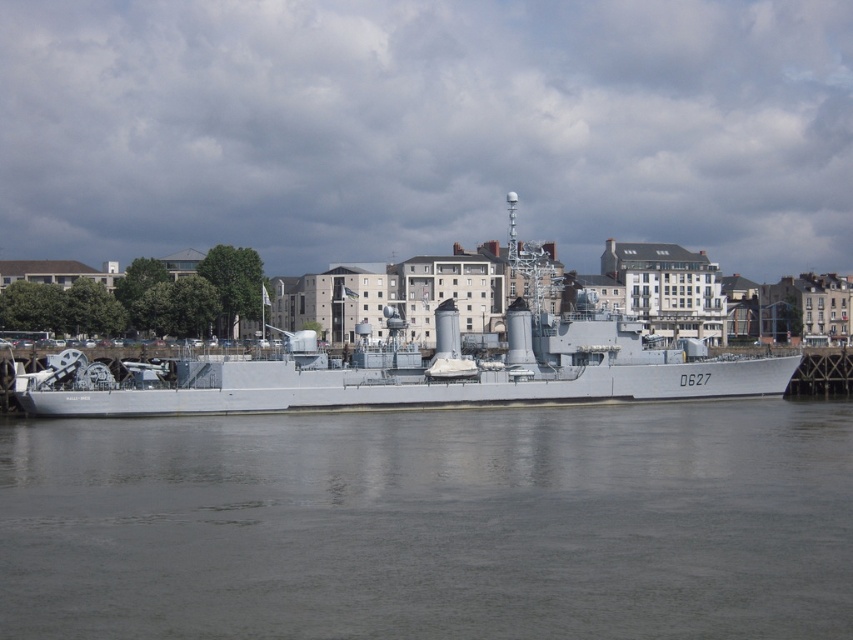
Is gray smooth water at center below white metallic ship at center?

Yes, gray smooth water at center is below white metallic ship at center.

Is gray smooth water at center behind white metallic ship at center?

No, gray smooth water at center is in front of white metallic ship at center.

Does point (601, 490) come closer to viewer compared to point (560, 346)?

Yes, point (601, 490) is in front of point (560, 346).

Locate an element on the screen. gray smooth water at center is located at coordinates (432, 524).